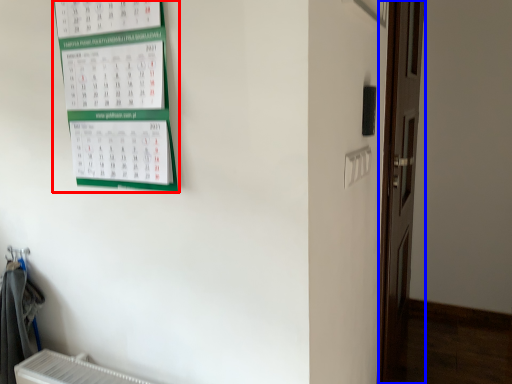
Question: Which point is closer to the camera, bulletin board (highlighted by a red box) or door (highlighted by a blue box)?

Choices:
 (A) bulletin board
 (B) door

Answer: (A)